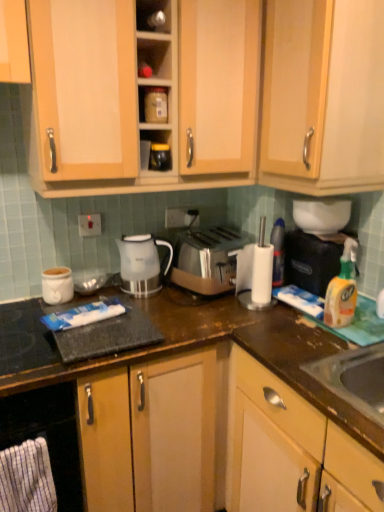
Question: Is matte plastic container at upper center, placed as the second shelf when sorted from top to bottom, bigger than metallic silver container at upper center, which is the 2th shelf in bottom-to-top order?

Choices:
 (A) yes
 (B) no

Answer: (A)

Question: Is the position of matte plastic container at upper center, placed as the second shelf when sorted from top to bottom, more distant than that of metallic silver container at upper center, the 1th shelf in the top-to-bottom sequence?

Choices:
 (A) yes
 (B) no

Answer: (A)

Question: Is matte plastic container at upper center, which ranks as the 1th shelf in bottom-to-top order, outside metallic silver container at upper center, which is the 2th shelf in bottom-to-top order?

Choices:
 (A) no
 (B) yes

Answer: (B)

Question: Does matte plastic container at upper center, placed as the second shelf when sorted from top to bottom, come in front of metallic silver container at upper center, the 1th shelf in the top-to-bottom sequence?

Choices:
 (A) yes
 (B) no

Answer: (B)

Question: Does matte plastic container at upper center, which ranks as the 1th shelf in bottom-to-top order, appear on the left side of metallic silver container at upper center, the 1th shelf in the top-to-bottom sequence?

Choices:
 (A) yes
 (B) no

Answer: (B)

Question: Can you confirm if matte plastic container at upper center, which ranks as the 1th shelf in bottom-to-top order, is taller than metallic silver container at upper center, the 1th shelf in the top-to-bottom sequence?

Choices:
 (A) no
 (B) yes

Answer: (B)

Question: Is there a large distance between white plastic paper towel holder at right and white plastic blender at center?

Choices:
 (A) yes
 (B) no

Answer: (B)

Question: Can you confirm if white plastic paper towel holder at right is taller than white plastic blender at center?

Choices:
 (A) yes
 (B) no

Answer: (B)

Question: Could white plastic blender at center be considered to be inside white plastic paper towel holder at right?

Choices:
 (A) yes
 (B) no

Answer: (B)

Question: From the image's perspective, does white plastic paper towel holder at right appear lower than white plastic blender at center?

Choices:
 (A) yes
 (B) no

Answer: (B)

Question: Is the depth of white plastic paper towel holder at right less than that of white plastic blender at center?

Choices:
 (A) no
 (B) yes

Answer: (A)

Question: Is white plastic paper towel holder at right facing away from white plastic blender at center?

Choices:
 (A) yes
 (B) no

Answer: (A)

Question: Is white plastic blender at center at the right side of white plastic paper towel holder at right?

Choices:
 (A) no
 (B) yes

Answer: (A)